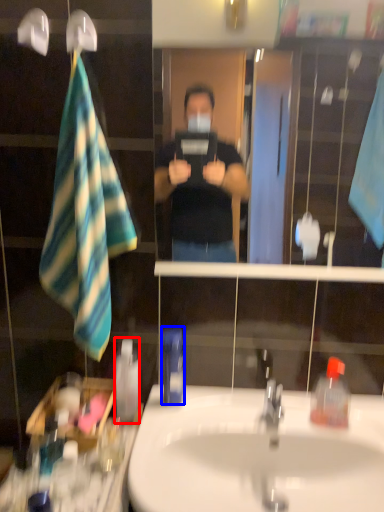
Question: Among these objects, which one is farthest to the camera, mouthwash (highlighted by a red box) or mouthwash (highlighted by a blue box)?

Choices:
 (A) mouthwash
 (B) mouthwash

Answer: (A)